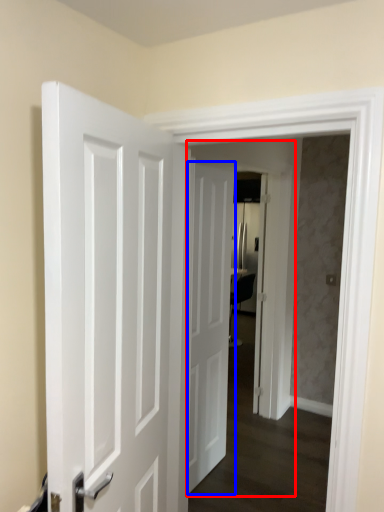
Question: Which of the following is the closest to the observer, screen door (highlighted by a red box) or door (highlighted by a blue box)?

Choices:
 (A) screen door
 (B) door

Answer: (A)